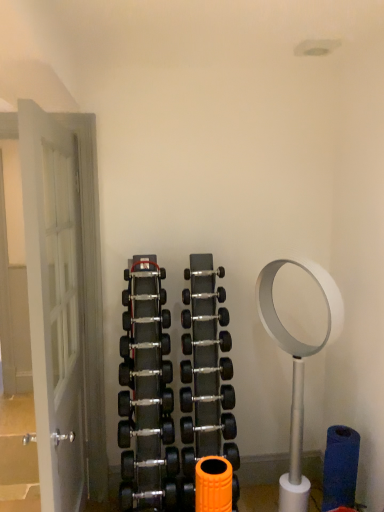
Question: Is black rubber dumbbell at center, the seventh dumbbell positioned from the bottom, oriented away from black rubber dumbbell at center, which appears as the 3th dumbbell when viewed from the top?

Choices:
 (A) yes
 (B) no

Answer: (B)

Question: From the image's perspective, is black rubber dumbbell at center, the seventh dumbbell positioned from the bottom, on top of black rubber dumbbell at center, the ninth dumbbell positioned from the bottom?

Choices:
 (A) yes
 (B) no

Answer: (B)

Question: Does black rubber dumbbell at center, which ranks as the fifth dumbbell in top-to-bottom order, have a lesser width compared to black rubber dumbbell at center, which appears as the 3th dumbbell when viewed from the top?

Choices:
 (A) no
 (B) yes

Answer: (A)

Question: Is black rubber dumbbell at center, the seventh dumbbell positioned from the bottom, located outside black rubber dumbbell at center, which appears as the 3th dumbbell when viewed from the top?

Choices:
 (A) no
 (B) yes

Answer: (B)

Question: Are black rubber dumbbell at center, the seventh dumbbell positioned from the bottom, and black rubber dumbbell at center, which appears as the 3th dumbbell when viewed from the top, beside each other?

Choices:
 (A) yes
 (B) no

Answer: (B)

Question: Considering the positions of point (125, 392) and point (142, 274), is point (125, 392) closer or farther from the camera than point (142, 274)?

Choices:
 (A) farther
 (B) closer

Answer: (B)

Question: In the image, is black rubber dumbbell at center, which is counted as the third dumbbell, starting from the bottom, positioned in front of or behind black rubber dumbbell at center, arranged as the 2th dumbbell when viewed from the top?

Choices:
 (A) front
 (B) behind

Answer: (A)

Question: From a real-world perspective, is black rubber dumbbell at center, which is counted as the third dumbbell, starting from the bottom, above or below black rubber dumbbell at center, which is the tenth dumbbell in bottom-to-top order?

Choices:
 (A) above
 (B) below

Answer: (B)

Question: Choose the correct answer: Is black rubber dumbbell at center, which is counted as the third dumbbell, starting from the bottom, inside black rubber dumbbell at center, arranged as the 2th dumbbell when viewed from the top, or outside it?

Choices:
 (A) outside
 (B) inside

Answer: (A)

Question: Is white wooden door at left bigger or smaller than black rubber dumbbell at center, which ranks as the fifth dumbbell in top-to-bottom order?

Choices:
 (A) big
 (B) small

Answer: (A)

Question: Considering their positions, is white wooden door at left located in front of or behind black rubber dumbbell at center, which ranks as the fifth dumbbell in top-to-bottom order?

Choices:
 (A) front
 (B) behind

Answer: (A)

Question: Do you think white wooden door at left is within black rubber dumbbell at center, which ranks as the fifth dumbbell in top-to-bottom order, or outside of it?

Choices:
 (A) inside
 (B) outside

Answer: (B)

Question: Is white wooden door at left wider or thinner than black rubber dumbbell at center, which ranks as the fifth dumbbell in top-to-bottom order?

Choices:
 (A) wide
 (B) thin

Answer: (A)

Question: Based on their positions, is black rubber dumbbell at center, the seventh dumbbell positioned from the bottom, located to the left or right of black rubber dumbbell at center, the 6th dumbbell viewed from the top?

Choices:
 (A) right
 (B) left

Answer: (A)

Question: In terms of height, does black rubber dumbbell at center, the seventh dumbbell positioned from the bottom, look taller or shorter compared to black rubber dumbbell at center, the sixth dumbbell from the bottom?

Choices:
 (A) tall
 (B) short

Answer: (B)